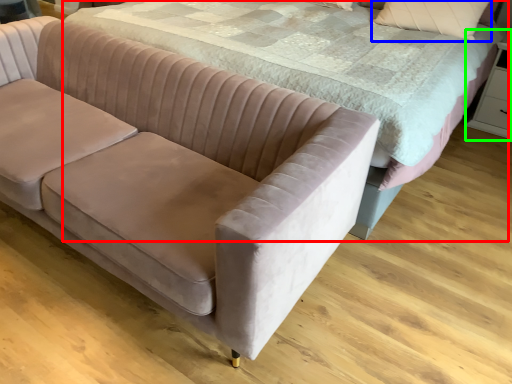
Question: Which is farther away from bed (highlighted by a red box)? pillow (highlighted by a blue box) or dresser (highlighted by a green box)?

Choices:
 (A) pillow
 (B) dresser

Answer: (B)